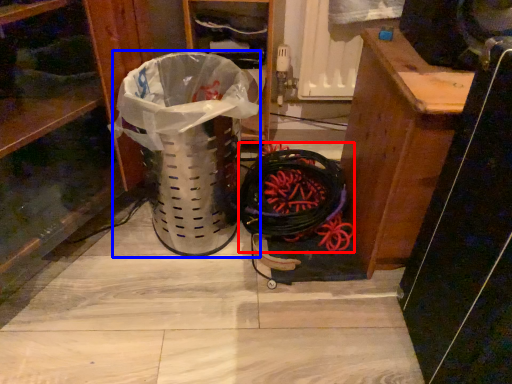
Question: Which object appears farthest to the camera in this image, battle rope (highlighted by a red box) or garbage (highlighted by a blue box)?

Choices:
 (A) battle rope
 (B) garbage

Answer: (A)